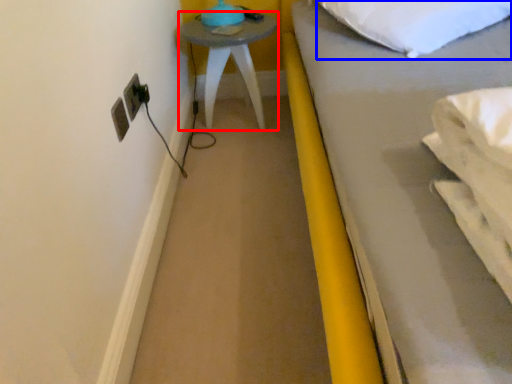
Question: Which point is closer to the camera, furniture (highlighted by a red box) or pillow (highlighted by a blue box)?

Choices:
 (A) furniture
 (B) pillow

Answer: (B)